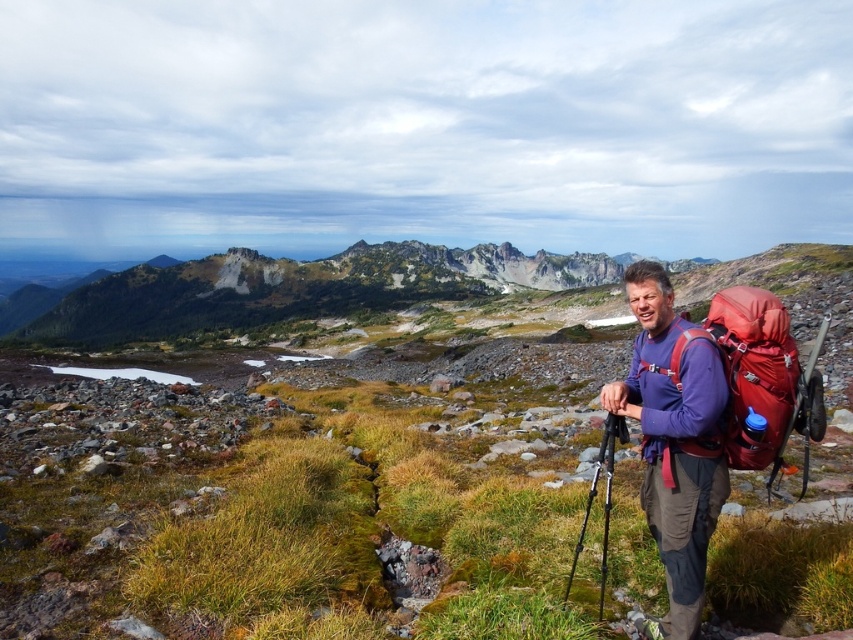
You are a photographer planning to set up your equipment in the scene described. You have a green grass at center and a black metal tripod at center. Which object is taller, and why might that matter for setting up your tripod?

The green grass at center is much taller than the black metal tripod at center. This matters because the tripod might be obscured by the tall grass, making it difficult to set up or see your equipment properly.

You are a hiker who wants to take a photo of the green grass at center. According to the coordinates provided, where exactly should you aim your camera?

The green grass at center is located at coordinates point (302, 500), so aim your camera there.

You are a photographer planning to set up your equipment. You have the matte red backpack at right and the black metal tripod at center. Which object is closer to you, the photographer, as you stand in the scene?

The matte red backpack at right is closer to you because it is positioned in front of the black metal tripod at center.